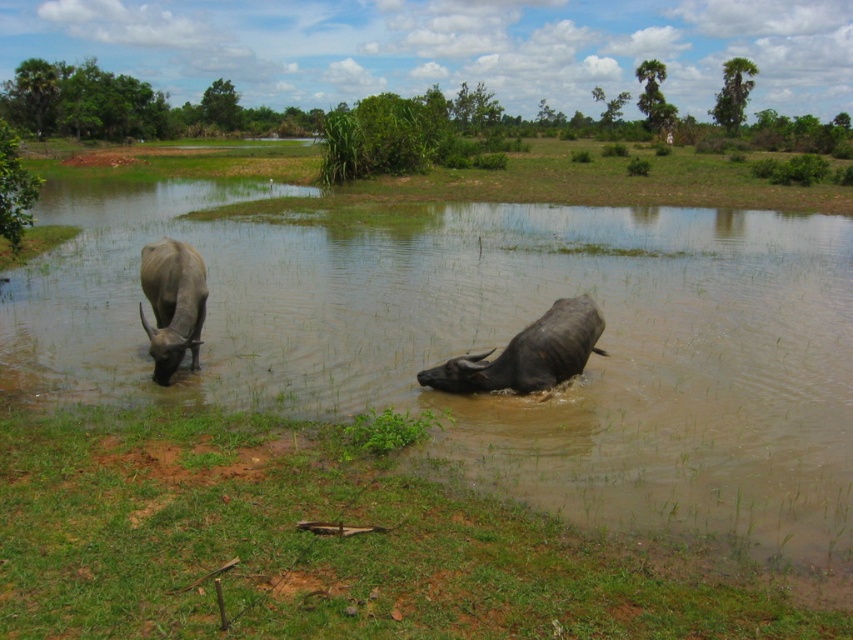
How much distance is there between brown muddy river at center and dark gray wet bull at center?

The distance of brown muddy river at center from dark gray wet bull at center is 11.25 feet.

Who is more forward, (838, 316) or (564, 348)?

Point (564, 348)

Find the location of a particular element. brown muddy river at center is located at coordinates (492, 342).

Between green grass at lower left and dark gray wet bull at center, which one appears on the left side from the viewer's perspective?

Positioned to the left is green grass at lower left.

How distant is green grass at lower left from dark gray wet bull at center?

green grass at lower left is 2.48 meters from dark gray wet bull at center.

I want to click on green grass at lower left, so click(322, 545).

Identify the location of green grass at lower left. (322, 545).

Between brown muddy river at center and gray matte yak at left, which one is positioned lower?

gray matte yak at left is lower down.

Can you confirm if brown muddy river at center is positioned to the left of gray matte yak at left?

In fact, brown muddy river at center is to the right of gray matte yak at left.

Where is `brown muddy river at center`? The width and height of the screenshot is (853, 640). brown muddy river at center is located at coordinates (492, 342).